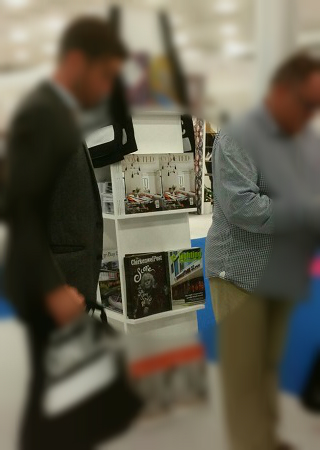
Find the location of `blurred lights on ceiling`. blurred lights on ceiling is located at coordinates (217, 21).